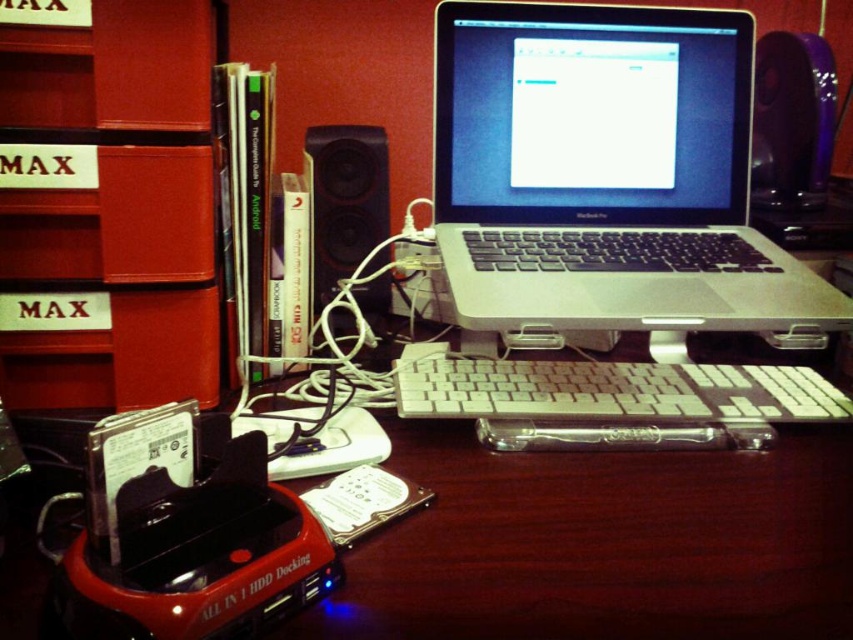
You are a person sitting at the desk in the image. You need to reach for the white plastic keyboard at center. Where should you extend your hand to reach it?

You should extend your hand to the position at point (614, 390) to reach the white plastic keyboard at center.

What is located at the coordinates point (x=614, y=390)?

The white plastic keyboard at center is located at point (x=614, y=390).